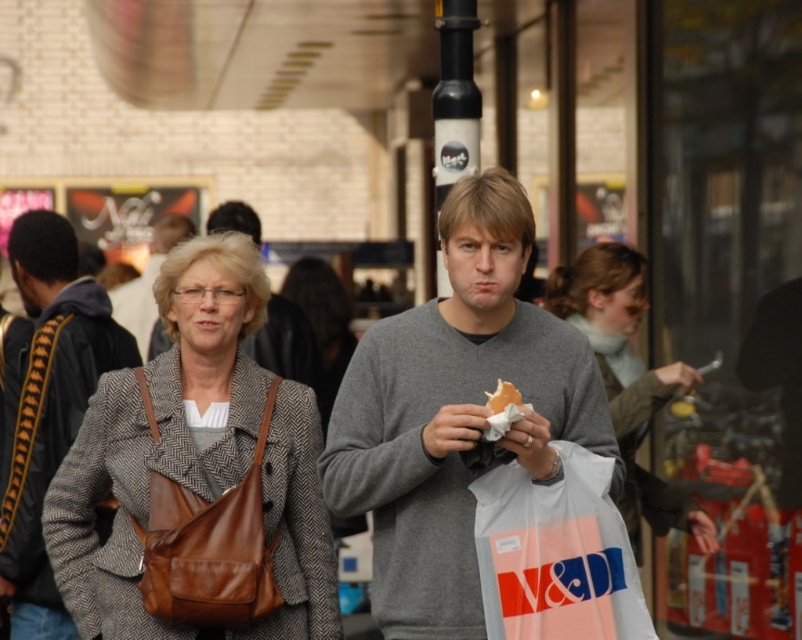
You are a delivery person who needs to place a small package between the matte brown leather bag at center and the gray wool coat at center. Based on their heights, which object should you place the package closer to?

The matte brown leather bag at center has a lesser height compared to the gray wool coat at center, so you should place the package closer to the matte brown leather bag at center to ensure stability.